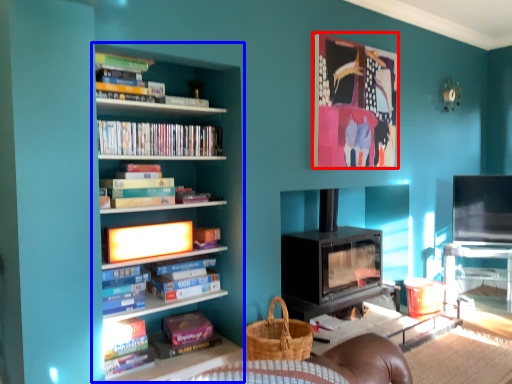
Question: Which object appears farthest to the camera in this image, picture frame (highlighted by a red box) or bookcase (highlighted by a blue box)?

Choices:
 (A) picture frame
 (B) bookcase

Answer: (A)